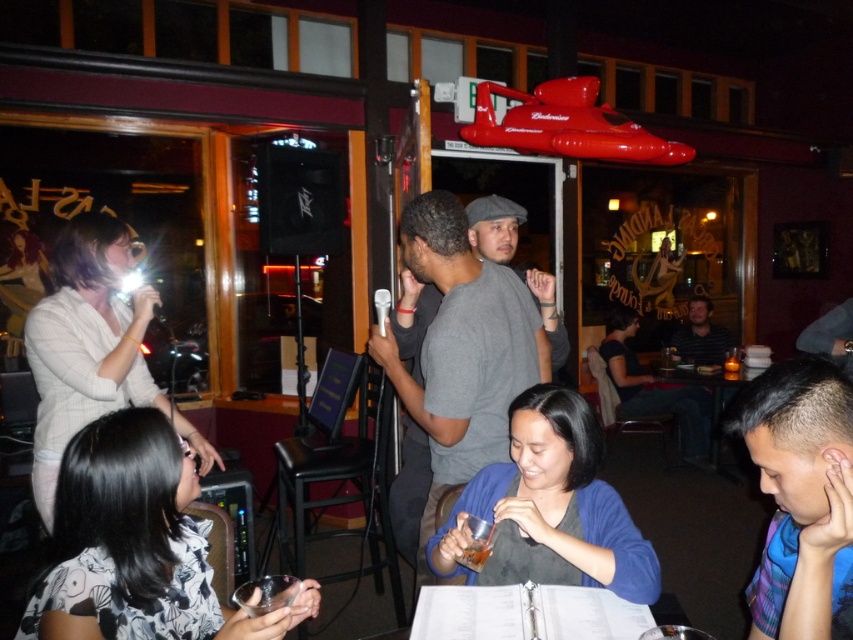
Question: Can you confirm if short hair at lower right is positioned above striped shirt at center?

Choices:
 (A) no
 (B) yes

Answer: (A)

Question: In this image, where is gray cotton shirt at center located relative to translucent plastic cup at lower center?

Choices:
 (A) above
 (B) below

Answer: (A)

Question: Which object is closer to the camera taking this photo?

Choices:
 (A) short hair at lower right
 (B) translucent plastic cup at lower center

Answer: (A)

Question: Is short hair at lower right below striped shirt at center?

Choices:
 (A) no
 (B) yes

Answer: (B)

Question: Which point is closer to the camera?

Choices:
 (A) (474, 570)
 (B) (280, 584)

Answer: (B)

Question: Estimate the real-world distances between objects in this image. Which object is closer to the translucent glass cup at center?

Choices:
 (A) striped shirt at center
 (B) translucent glass beverage at center
 (C) clear plastic cup at lower center

Answer: (C)